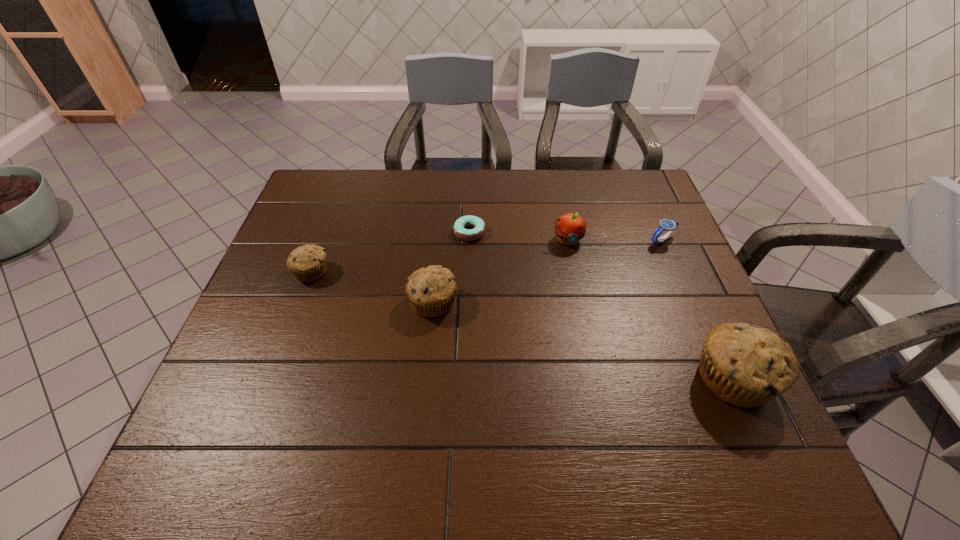
Locate an element on the screen. The image size is (960, 540). vacant area at the near edge of the desktop is located at coordinates (369, 382).

Locate an element on the screen. The image size is (960, 540). vacant space at the left edge of the desktop is located at coordinates (276, 310).

I want to click on vacant region at the right edge of the desktop, so click(707, 317).

Where is `vacant space at the far right corner of the desktop`? vacant space at the far right corner of the desktop is located at coordinates pos(650,189).

You are a GUI agent. You are given a task and a screenshot of the screen. Output one action in this format:
    pyautogui.click(x=<x>, y=<y>)
    Task: Click on the free space between the doughnut and the shortest muffin
    
    Given the screenshot: What is the action you would take?
    pyautogui.click(x=391, y=252)

Image resolution: width=960 pixels, height=540 pixels. What are the coordinates of `free space between the watch and the fourth object from left to right` in the screenshot? It's located at (614, 240).

This screenshot has width=960, height=540. In order to click on vacant area that lies between the apple and the rightmost muffin in this screenshot , I will do 651,309.

Find the location of a particular element. The image size is (960, 540). unoccupied area between the apple and the second shortest object is located at coordinates pos(614,240).

Find the location of a particular element. The height and width of the screenshot is (540, 960). vacant area that lies between the apple and the tallest muffin is located at coordinates (651, 309).

Identify the location of blank region between the doughnut and the shortest muffin. This screenshot has height=540, width=960. (391, 252).